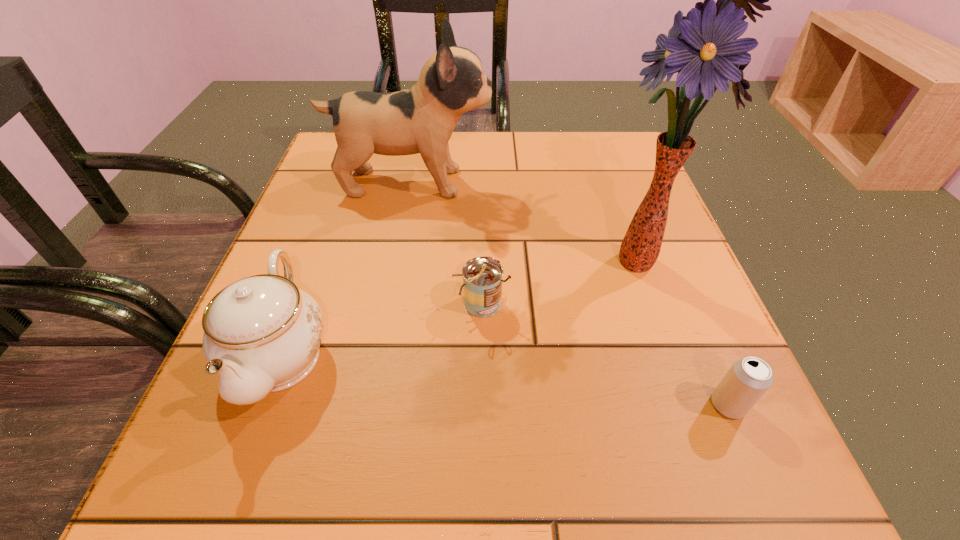
I want to click on blank area located 0.170m on the left of the beer can, so click(x=590, y=405).

I want to click on object that is positioned at the far edge, so (x=421, y=120).

Where is `puppy at the left edge`? The height and width of the screenshot is (540, 960). puppy at the left edge is located at coordinates pos(421,120).

The image size is (960, 540). Identify the location of chinaware at the left edge. (262, 334).

At what (x,y) coordinates should I click in order to perform the action: click on flower arrangement that is at the right edge. Please return your answer as a coordinate pair (x, y). Looking at the image, I should click on (703, 48).

Find the location of `beer can positioned at the right edge`. beer can positioned at the right edge is located at coordinates (748, 379).

This screenshot has width=960, height=540. Identify the location of object situated at the far left corner. 421,120.

Find the location of a particular element. Image resolution: width=960 pixels, height=540 pixels. vacant space at the far edge is located at coordinates (472, 145).

Find the location of `vacant space at the left edge of the desktop`. vacant space at the left edge of the desktop is located at coordinates (261, 434).

This screenshot has width=960, height=540. I want to click on free region at the right edge, so click(x=635, y=386).